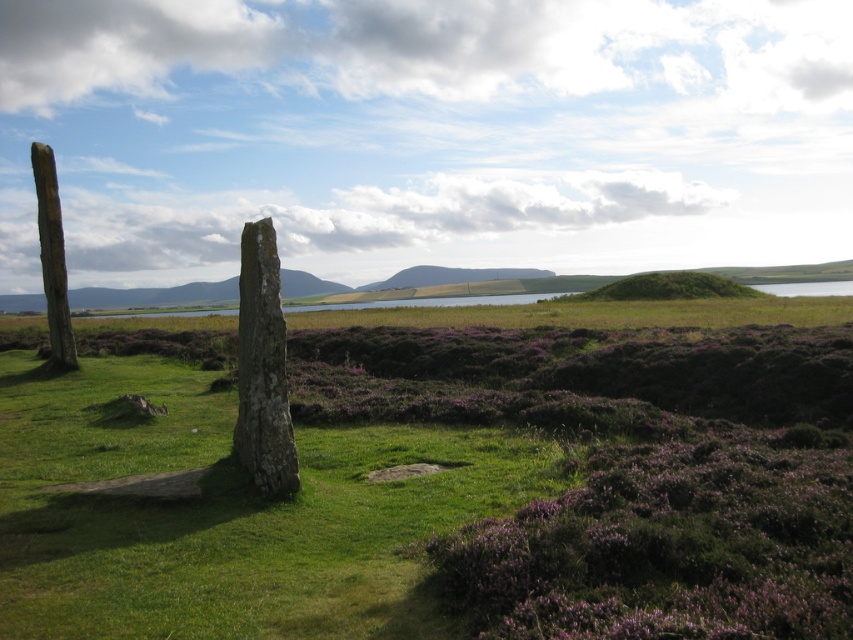
Question: Is green grassy at center behind smooth wooden pole at left?

Choices:
 (A) no
 (B) yes

Answer: (A)

Question: Can you confirm if green mossy stone at center is thinner than smooth wooden pole at left?

Choices:
 (A) no
 (B) yes

Answer: (B)

Question: Estimate the real-world distances between objects in this image. Which object is farther from the smooth wooden pole at left?

Choices:
 (A) green grassy at center
 (B) green mossy stone at center

Answer: (B)

Question: Can you confirm if green mossy stone at center is bigger than smooth wooden pole at left?

Choices:
 (A) yes
 (B) no

Answer: (B)

Question: Which point is closer to the camera?

Choices:
 (A) green grassy at center
 (B) smooth wooden pole at left

Answer: (A)

Question: Which of these objects is positioned farthest from the smooth wooden pole at left?

Choices:
 (A) green grassy at center
 (B) green mossy stone at center

Answer: (B)